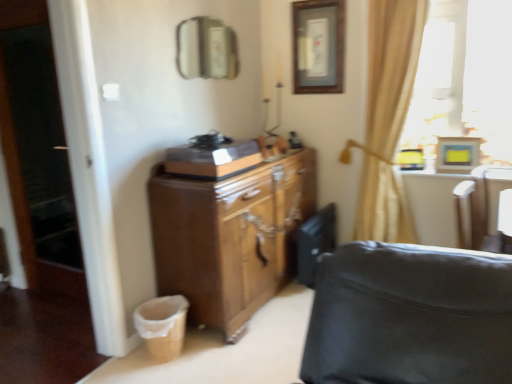
The height and width of the screenshot is (384, 512). Identify the location of vacant region above metallic rectangular mirror at upper center (from a real-world perspective). (206, 7).